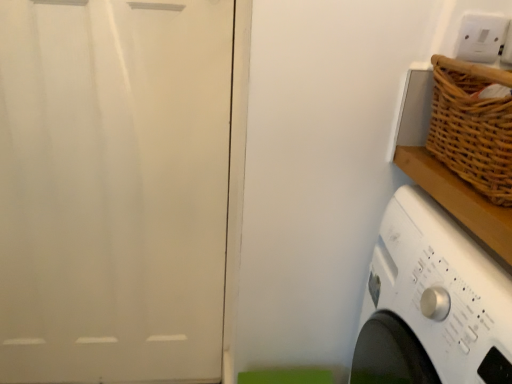
Measure the distance between point (461, 25) and camera.

31.77 inches.

Describe the element at coordinates (480, 37) in the screenshot. I see `white plastic electric outlet at upper right` at that location.

You are a GUI agent. You are given a task and a screenshot of the screen. Output one action in this format:
    pyautogui.click(x=<x>, y=<y>)
    Task: Click on the white glossy screen door at left
    Image resolution: width=512 pixels, height=384 pixels.
    Given the screenshot: What is the action you would take?
    pyautogui.click(x=113, y=188)

Is the position of white plastic washing machine at lower right more distant than that of woven brown basket at upper right?

No, white plastic washing machine at lower right is closer to the viewer.

Are white plastic washing machine at lower right and woven brown basket at upper right located far from each other?

They are positioned close to each other.

Where is `washing machine on the right of woven brown basket at upper right`? The height and width of the screenshot is (384, 512). washing machine on the right of woven brown basket at upper right is located at coordinates (432, 302).

In the scene shown: From a real-world perspective, is white plastic washing machine at lower right physically below woven brown basket at upper right?

Correct, in the physical world, white plastic washing machine at lower right is lower than woven brown basket at upper right.

Can you confirm if white plastic electric outlet at upper right is bigger than white plastic washing machine at lower right?

No, white plastic electric outlet at upper right is not bigger than white plastic washing machine at lower right.

Which object is positioned more to the right, white plastic electric outlet at upper right or white plastic washing machine at lower right?

white plastic washing machine at lower right.

Which is in front, white plastic electric outlet at upper right or white plastic washing machine at lower right?

white plastic washing machine at lower right is in front.

From the image's perspective, which object appears higher, white plastic electric outlet at upper right or white plastic washing machine at lower right?

white plastic electric outlet at upper right is shown above in the image.

Is white glossy screen door at left positioned with its back to white plastic electric outlet at upper right?

No, white glossy screen door at left is not facing the opposite direction of white plastic electric outlet at upper right.

Consider the image. Is the position of white glossy screen door at left less distant than that of white plastic electric outlet at upper right?

No, it is behind white plastic electric outlet at upper right.

Measure the distance from white glossy screen door at left to white plastic electric outlet at upper right.

white glossy screen door at left is 34.23 inches from white plastic electric outlet at upper right.

From the image's perspective, is white glossy screen door at left above white plastic electric outlet at upper right?

Actually, white glossy screen door at left appears below white plastic electric outlet at upper right in the image.

Consider the image. Does white plastic electric outlet at upper right have a lesser width compared to woven brown basket at upper right?

Indeed, white plastic electric outlet at upper right has a lesser width compared to woven brown basket at upper right.

Is white plastic electric outlet at upper right bigger than woven brown basket at upper right?

No.

Looking at this image, is white plastic electric outlet at upper right situated inside woven brown basket at upper right or outside?

white plastic electric outlet at upper right is located beyond the bounds of woven brown basket at upper right.

Which of these two, white plastic electric outlet at upper right or woven brown basket at upper right, stands shorter?

Standing shorter between the two is white plastic electric outlet at upper right.

Is woven brown basket at upper right oriented towards white plastic washing machine at lower right?

No, woven brown basket at upper right is not turned towards white plastic washing machine at lower right.

What's the angular difference between woven brown basket at upper right and white plastic washing machine at lower right's facing directions?

woven brown basket at upper right and white plastic washing machine at lower right are facing 4.65 degrees away from each other.

From the picture: Would you say woven brown basket at upper right is outside white plastic washing machine at lower right?

Yes.

Which is behind, point (450, 141) or point (410, 235)?

The point (450, 141) is behind.

In terms of height, does white plastic electric outlet at upper right look taller or shorter compared to white glossy screen door at left?

Considering their sizes, white plastic electric outlet at upper right has less height than white glossy screen door at left.

Looking at this image, is white plastic electric outlet at upper right facing towards white glossy screen door at left?

No, white plastic electric outlet at upper right does not turn towards white glossy screen door at left.

Which is behind, point (469, 51) or point (19, 166)?

Positioned behind is point (19, 166).

Considering the relative sizes of white plastic electric outlet at upper right and white glossy screen door at left in the image provided, is white plastic electric outlet at upper right bigger than white glossy screen door at left?

No, white plastic electric outlet at upper right is not bigger than white glossy screen door at left.

Considering the relative sizes of woven brown basket at upper right and white plastic electric outlet at upper right in the image provided, is woven brown basket at upper right shorter than white plastic electric outlet at upper right?

Incorrect, the height of woven brown basket at upper right does not fall short of that of white plastic electric outlet at upper right.

Between woven brown basket at upper right and white plastic electric outlet at upper right, which one is positioned in front?

Positioned in front is woven brown basket at upper right.

From the image's perspective, which one is positioned higher, woven brown basket at upper right or white plastic electric outlet at upper right?

From the image's view, white plastic electric outlet at upper right is above.

Is point (455, 147) farther from viewer compared to point (470, 41)?

No, it is in front of (470, 41).

Find the location of `washing machine that is on the right side of woven brown basket at upper right`. washing machine that is on the right side of woven brown basket at upper right is located at coordinates (432, 302).

Locate an element on the screen. The height and width of the screenshot is (384, 512). washing machine that is under the white plastic electric outlet at upper right (from a real-world perspective) is located at coordinates (432, 302).

Looking at the image, which one is located closer to white glossy screen door at left, woven brown basket at upper right or white plastic washing machine at lower right?

The object closer to white glossy screen door at left is white plastic washing machine at lower right.

Looking at this image, based on their spatial positions, is white glossy screen door at left or white plastic washing machine at lower right closer to white plastic electric outlet at upper right?

white plastic washing machine at lower right lies closer to white plastic electric outlet at upper right than the other object.

Based on the photo, which object lies further to the anchor point white glossy screen door at left, woven brown basket at upper right or white plastic electric outlet at upper right?

white plastic electric outlet at upper right.

Considering their positions, is white plastic electric outlet at upper right positioned further to white glossy screen door at left than white plastic washing machine at lower right?

The object further to white glossy screen door at left is white plastic electric outlet at upper right.

Estimate the real-world distances between objects in this image. Which object is closer to white plastic washing machine at lower right, woven brown basket at upper right or white glossy screen door at left?

Among the two, woven brown basket at upper right is located nearer to white plastic washing machine at lower right.

Which object lies further to the anchor point white plastic electric outlet at upper right, white plastic washing machine at lower right or white glossy screen door at left?

The object further to white plastic electric outlet at upper right is white glossy screen door at left.

Looking at the image, which one is located closer to white plastic electric outlet at upper right, white glossy screen door at left or woven brown basket at upper right?

woven brown basket at upper right.

When comparing their distances from white plastic electric outlet at upper right, does woven brown basket at upper right or white plastic washing machine at lower right seem further?

The object further to white plastic electric outlet at upper right is white plastic washing machine at lower right.

The image size is (512, 384). What are the coordinates of `basket between white plastic electric outlet at upper right and white plastic washing machine at lower right in the vertical direction` in the screenshot? It's located at (472, 126).

At what (x,y) coordinates should I click in order to perform the action: click on electric outlet situated between white glossy screen door at left and white plastic washing machine at lower right from left to right. Please return your answer as a coordinate pair (x, y). Looking at the image, I should click on (480, 37).

Find the location of a particular element. Image resolution: width=512 pixels, height=384 pixels. basket between white glossy screen door at left and white plastic washing machine at lower right in the horizontal direction is located at coordinates (472, 126).

Locate an element on the screen. electric outlet located between white glossy screen door at left and woven brown basket at upper right in the left-right direction is located at coordinates (480, 37).